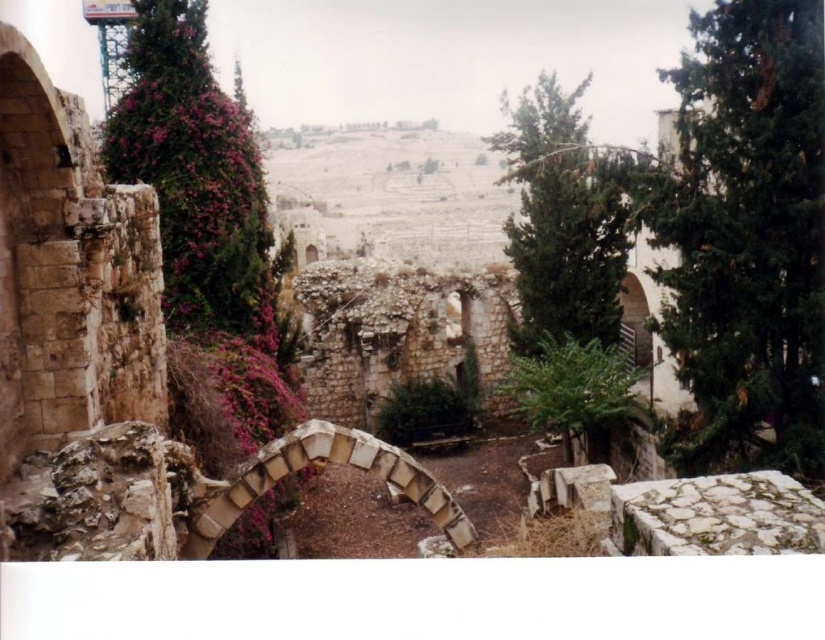
You are an archaeologist examining the ruins and want to document the pink textured foliage at left and the green leafy tree at upper right. Which of these two plants is positioned further to the left side of the image?

The pink textured foliage at left is positioned to the left of the green leafy tree at upper right, so it is further to the left side of the image.

You are an archaeologist examining the ancient stone ruins. You notice two trees in the scene. Which of the two trees, the green textured tree at right or the green leafy tree at upper right, is shorter?

The green textured tree at right is shorter than the green leafy tree at upper right.

You are standing in the courtyard and want to take a photo of both the green textured tree at right and the green leafy tree at upper right. Which tree should you position yourself closer to in order to capture both in the same frame?

You should position yourself closer to the green textured tree at right because it is to the left of the green leafy tree at upper right, so moving closer to the closer tree will help include both in the frame.